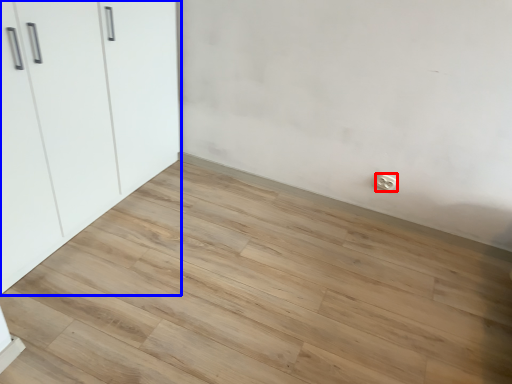
Question: Which of the following is the closest to the observer, electric outlet (highlighted by a red box) or cupboard (highlighted by a blue box)?

Choices:
 (A) electric outlet
 (B) cupboard

Answer: (B)